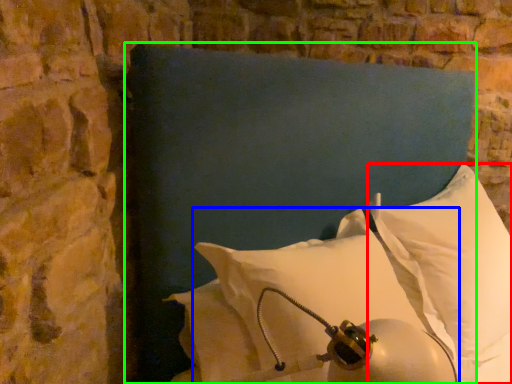
Question: Which is farther away from pillow (highlighted by a red box)? pillow (highlighted by a blue box) or pillow (highlighted by a green box)?

Choices:
 (A) pillow
 (B) pillow

Answer: (A)